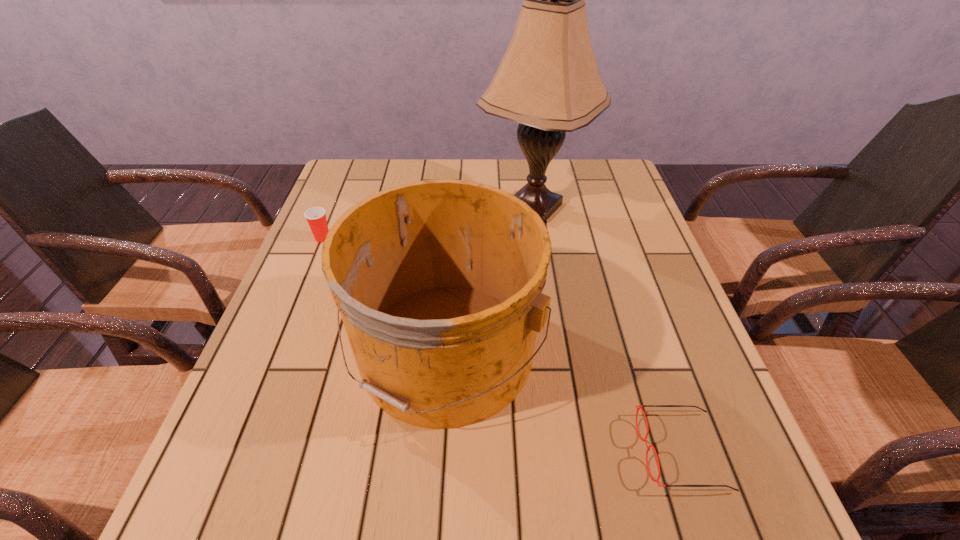
What are the coordinates of `free space at the left edge of the desktop` in the screenshot? It's located at click(x=241, y=427).

Where is `vacant space at the right edge of the desktop`? vacant space at the right edge of the desktop is located at coordinates (650, 240).

You are a GUI agent. You are given a task and a screenshot of the screen. Output one action in this format:
    pyautogui.click(x=<x>, y=<y>)
    Task: Click on the vacant space at the near left corner
    The width and height of the screenshot is (960, 540).
    Given the screenshot: What is the action you would take?
    pyautogui.click(x=279, y=496)

In the image, there is a desktop. Where is `vacant area at the far right corner`? vacant area at the far right corner is located at coordinates (604, 162).

Where is `vacant area that lies between the second tallest object and the spectacles`? vacant area that lies between the second tallest object and the spectacles is located at coordinates (563, 401).

Locate an element on the screen. The width and height of the screenshot is (960, 540). vacant area that lies between the spectacles and the bucket is located at coordinates (563, 401).

This screenshot has width=960, height=540. In order to click on the third closest object to the leftmost object in this screenshot , I will do `click(640, 406)`.

The height and width of the screenshot is (540, 960). I want to click on the second closest object to the tallest object, so click(316, 217).

Find the location of `free space that satisfies the following two spatial constraints: 1. on the back side of the tallest object; 2. on the left side of the bucket`. free space that satisfies the following two spatial constraints: 1. on the back side of the tallest object; 2. on the left side of the bucket is located at coordinates (454, 207).

This screenshot has height=540, width=960. Identify the location of vacant region that satisfies the following two spatial constraints: 1. on the front side of the leftmost object; 2. on the left side of the bucket. (276, 351).